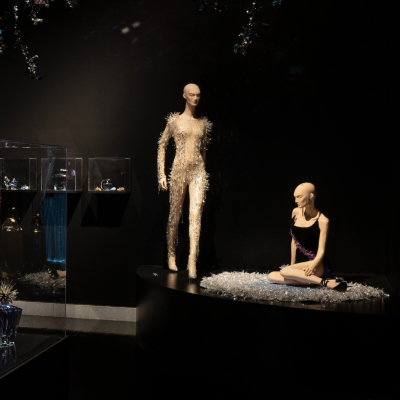
Find the location of a particular element. mannequin is located at coordinates point(182,120), point(308,215).